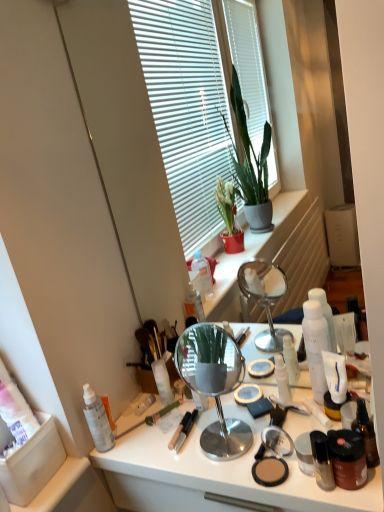
Identify the location of vacant area that lies between transparent plastic spray bottle at left, the 7th toiletry in the right-to-left sequence, and white glossy lotion at center, placed as the fifth toiletry when sorted from right to left. The height and width of the screenshot is (512, 384). (177, 428).